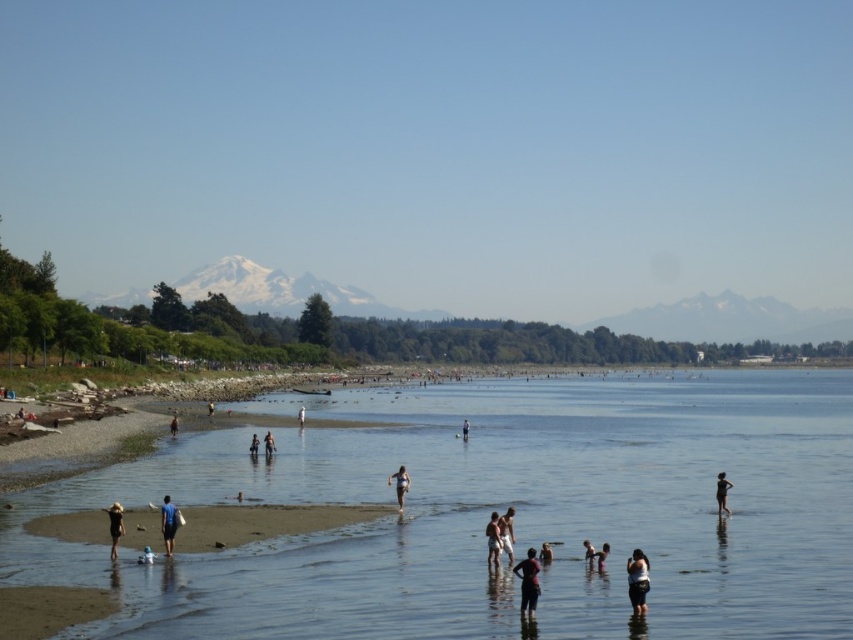
You are a photographer planning to take a photo of the beach scene. You want to ensure the dark blue fabric at lower center is centered in your shot. Given the coordinates provided, what adjustments should you make to the camera framing?

The dark blue fabric at lower center is located at coordinates point (637,579). To center it, adjust the camera framing so the center point aligns with these coordinates.

You are a photographer trying to capture a photo of the matte black swimsuit at lower right and the white fabric person at center. Based on their positions, which object is located to the right of the other?

The matte black swimsuit at lower right is positioned on the right side of white fabric person at center, so the matte black swimsuit at lower right is to the right of the white fabric person at center.